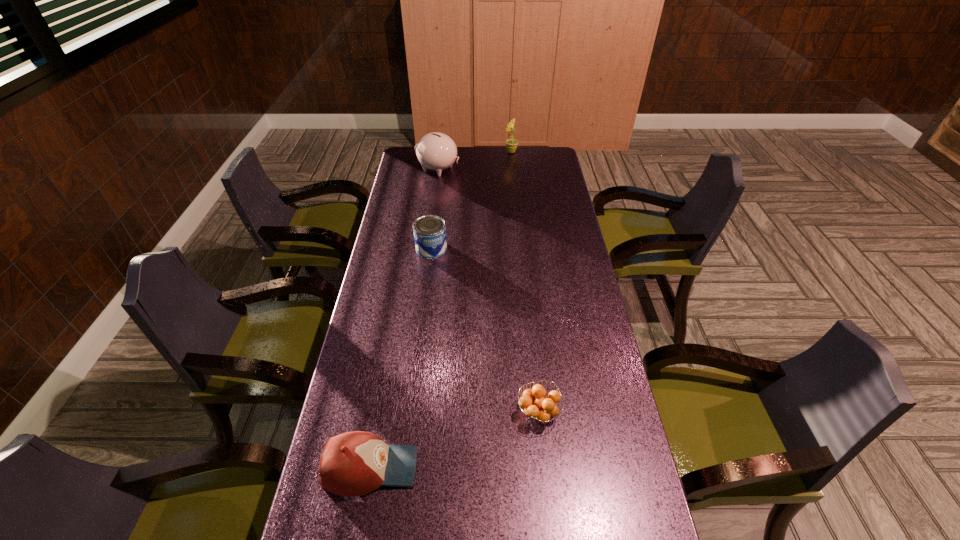
I want to click on vacant area in the image that satisfies the following two spatial constraints: 1. on the front label of the shortest object; 2. on the left side of the can, so click(x=412, y=412).